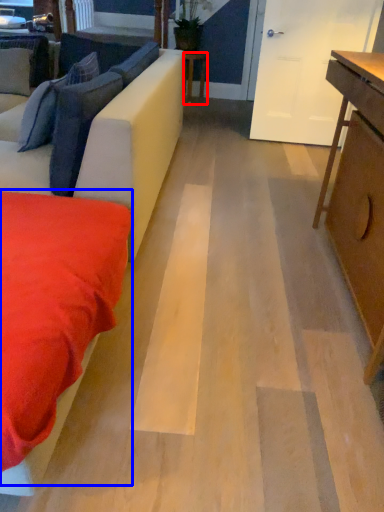
Question: Which point is closer to the camera, table (highlighted by a red box) or bedding (highlighted by a blue box)?

Choices:
 (A) table
 (B) bedding

Answer: (B)